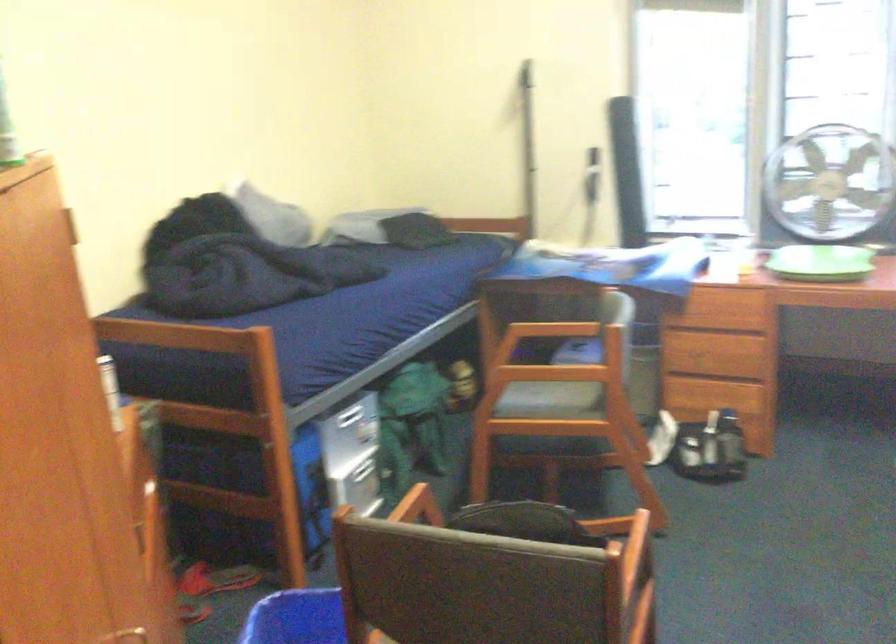
In order to click on dark chair seat in this screenshot , I will do `click(528, 523)`.